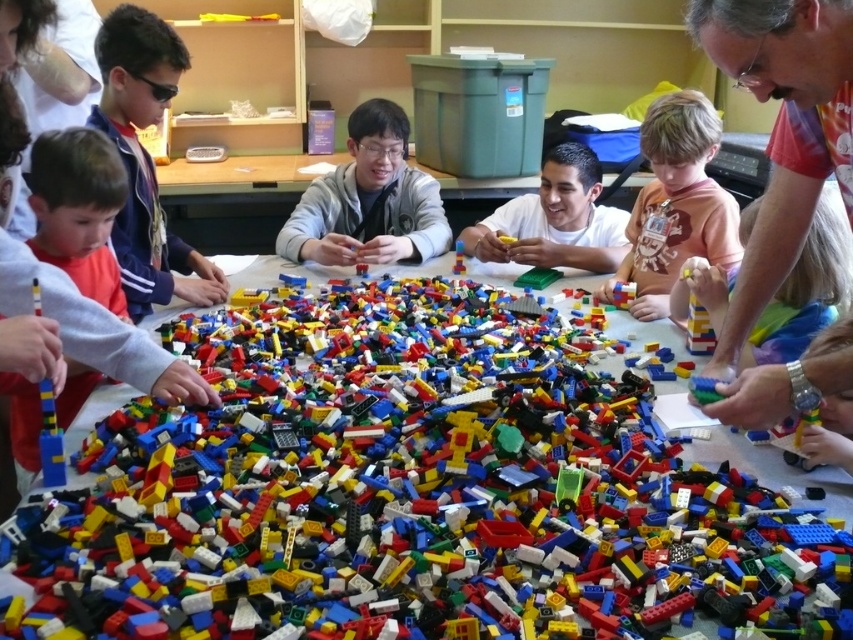
Question: Estimate the real-world distances between objects in this image. Which object is closer to the bright plastic lego bricks at center?

Choices:
 (A) smooth orange shirt at lower right
 (B) matte red shirt at upper right

Answer: (B)

Question: Can you confirm if matte black sunglasses at left is positioned to the right of matte orange shirt at lower left?

Choices:
 (A) no
 (B) yes

Answer: (A)

Question: Estimate the real-world distances between objects in this image. Which object is closer to the matte plastic boy at center?

Choices:
 (A) bright plastic lego bricks at center
 (B) matte black sunglasses at left
 (C) matte red shirt at upper right
 (D) matte orange shirt at lower left

Answer: (A)

Question: Is matte black sunglasses at left in front of smooth orange shirt at lower right?

Choices:
 (A) no
 (B) yes

Answer: (A)

Question: Is smooth orange shirt at lower right smaller than matte orange shirt at lower left?

Choices:
 (A) yes
 (B) no

Answer: (B)

Question: Which point is closer to the camera taking this photo?

Choices:
 (A) (107, 218)
 (B) (825, 13)
 (C) (103, 54)

Answer: (B)